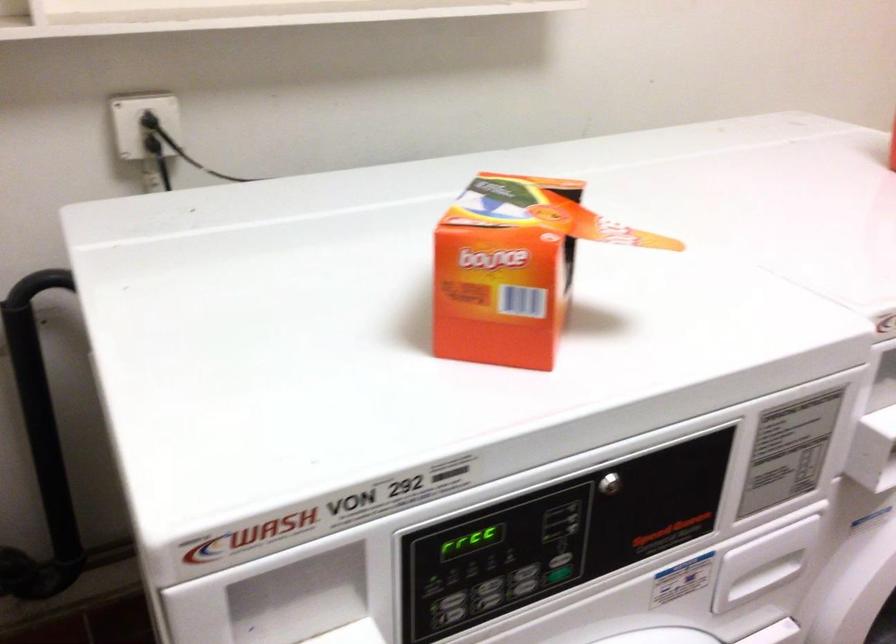
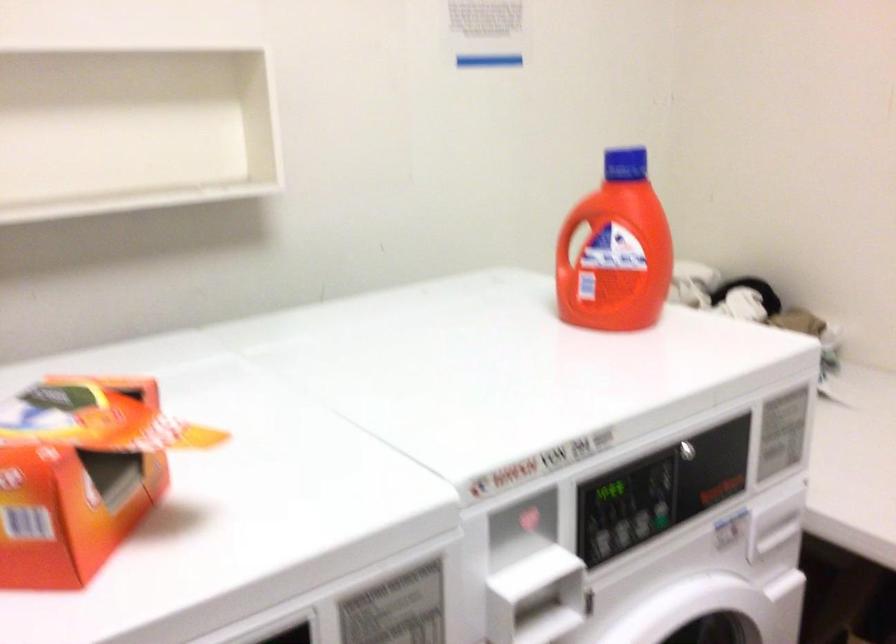
Question: What movement of the cameraman would produce the second image?

Choices:
 (A) Left
 (B) Right
 (C) Forward
 (D) Backward

Answer: (B)